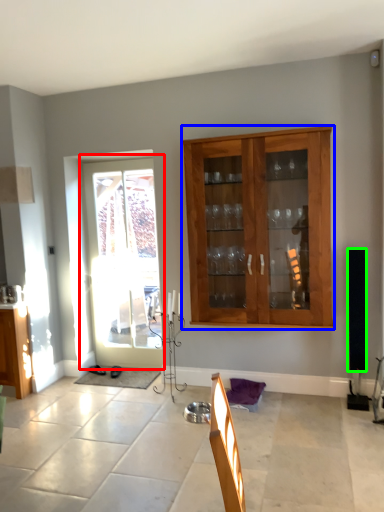
Question: Based on their relative distances, which object is nearer to door (highlighted by a red box)? Choose from cabinet (highlighted by a blue box) and loudspeaker (highlighted by a green box).

Choices:
 (A) cabinet
 (B) loudspeaker

Answer: (A)